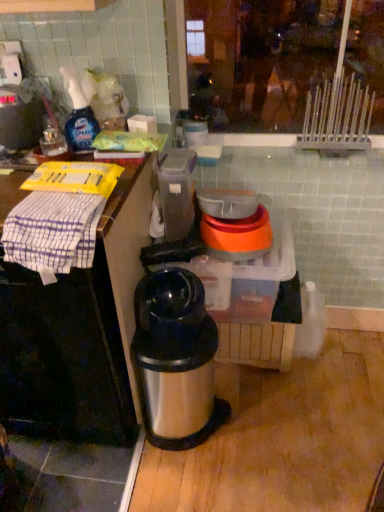
Question: Is orange plastic bowl at center, which is the 1th appliance from right to left, positioned far away from stainless steel thermos at center?

Choices:
 (A) no
 (B) yes

Answer: (A)

Question: From the image's perspective, is orange plastic bowl at center, which is the 1th appliance from right to left, located above stainless steel thermos at center?

Choices:
 (A) yes
 (B) no

Answer: (A)

Question: Is orange plastic bowl at center, which is the 1th appliance from right to left, next to stainless steel thermos at center?

Choices:
 (A) no
 (B) yes

Answer: (A)

Question: Can you confirm if orange plastic bowl at center, which is the 1th appliance from right to left, is positioned to the right of stainless steel thermos at center?

Choices:
 (A) yes
 (B) no

Answer: (A)

Question: Can you confirm if orange plastic bowl at center, which is the 1th appliance from right to left, is bigger than stainless steel thermos at center?

Choices:
 (A) yes
 (B) no

Answer: (B)

Question: From the image's perspective, is orange plastic bowl at center, which is the 1th appliance from right to left, under stainless steel thermos at center?

Choices:
 (A) no
 (B) yes

Answer: (A)

Question: Does translucent plastic container at center, placed as the 2th appliance when sorted from right to left, have a lesser height compared to brushed metal spray bottle at left?

Choices:
 (A) yes
 (B) no

Answer: (B)

Question: Can you confirm if translucent plastic container at center, which appears as the 1th appliance when viewed from the left, is thinner than brushed metal spray bottle at left?

Choices:
 (A) no
 (B) yes

Answer: (A)

Question: Is translucent plastic container at center, placed as the 2th appliance when sorted from right to left, bigger than brushed metal spray bottle at left?

Choices:
 (A) yes
 (B) no

Answer: (A)

Question: From the image's perspective, would you say translucent plastic container at center, placed as the 2th appliance when sorted from right to left, is shown under brushed metal spray bottle at left?

Choices:
 (A) no
 (B) yes

Answer: (B)

Question: Is brushed metal spray bottle at left inside translucent plastic container at center, which appears as the 1th appliance when viewed from the left?

Choices:
 (A) no
 (B) yes

Answer: (A)

Question: Is translucent plastic container at center, which appears as the 1th appliance when viewed from the left, not near brushed metal spray bottle at left?

Choices:
 (A) yes
 (B) no

Answer: (B)

Question: Is stainless steel thermos at center to the left of clear plastic spray bottle at upper left from the viewer's perspective?

Choices:
 (A) no
 (B) yes

Answer: (A)